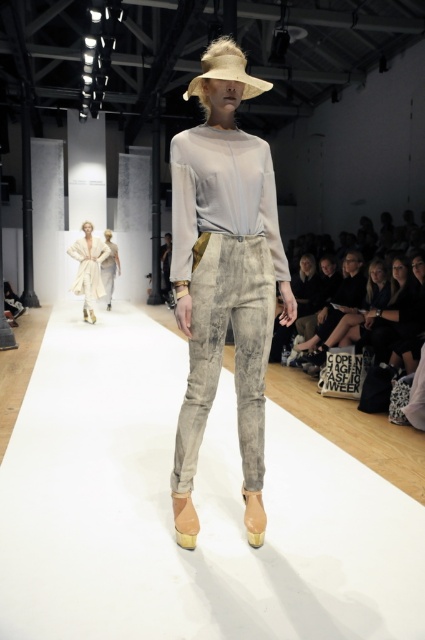
Question: Which point appears farthest from the camera in this image?

Choices:
 (A) pyautogui.click(x=209, y=58)
 (B) pyautogui.click(x=107, y=285)

Answer: (B)

Question: Which of the following is the closest to the observer?

Choices:
 (A) (112, 280)
 (B) (98, 273)
 (C) (190, 216)
 (D) (238, 68)

Answer: (D)

Question: Can you confirm if beige straw hat at center is wider than light beige textured pants at center?

Choices:
 (A) yes
 (B) no

Answer: (B)

Question: Based on their relative distances, which object is farther from the distressed linen pants at center?

Choices:
 (A) light beige textured pants at center
 (B) beige straw hat at center
 (C) matte white coat at center

Answer: (A)

Question: Can you confirm if distressed linen pants at center is positioned below matte white coat at center?

Choices:
 (A) yes
 (B) no

Answer: (A)

Question: Is distressed linen pants at center bigger than matte white coat at center?

Choices:
 (A) no
 (B) yes

Answer: (A)